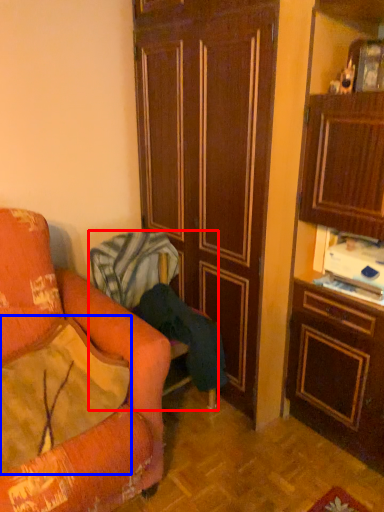
Question: Which of the following is the farthest to the observer, chair (highlighted by a red box) or pillow (highlighted by a blue box)?

Choices:
 (A) chair
 (B) pillow

Answer: (A)